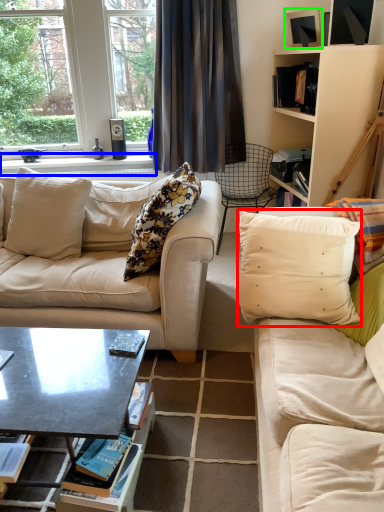
Question: Estimate the real-world distances between objects in this image. Which object is closer to pillow (highlighted by a red box), window sill (highlighted by a blue box) or picture frame (highlighted by a green box)?

Choices:
 (A) window sill
 (B) picture frame

Answer: (B)